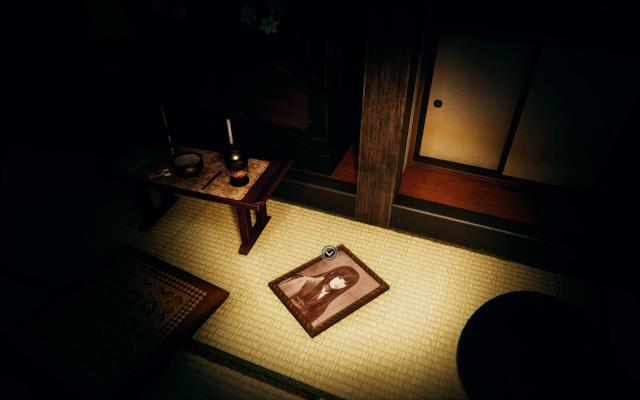
The image size is (640, 400). I want to click on frame, so click(x=383, y=290).